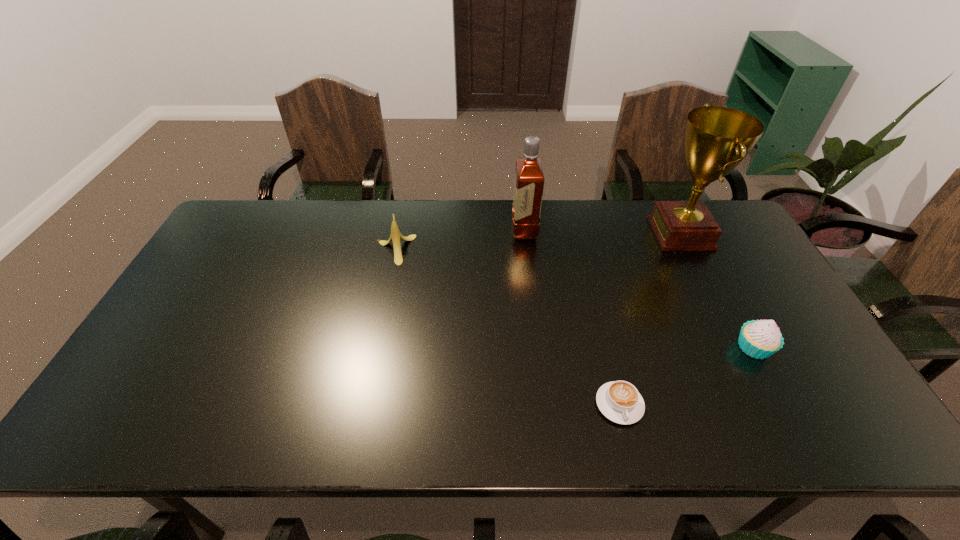
Locate an element on the screen. cupcake present at the right edge is located at coordinates (759, 339).

Where is `object at the far right corner`? Image resolution: width=960 pixels, height=540 pixels. object at the far right corner is located at coordinates (716, 139).

Where is `vacant space at the far edge of the desktop`? vacant space at the far edge of the desktop is located at coordinates (330, 200).

The image size is (960, 540). In the image, there is a desktop. In order to click on free space at the near edge in this screenshot , I will do `click(564, 429)`.

In the image, there is a desktop. Identify the location of vacant space at the left edge. (256, 250).

The image size is (960, 540). In the image, there is a desktop. Find the location of `free space at the far left corner`. free space at the far left corner is located at coordinates (244, 232).

In the image, there is a desktop. At what (x,y) coordinates should I click in order to perform the action: click on free region at the near left corner. Please return your answer as a coordinate pair (x, y). The image size is (960, 540). Looking at the image, I should click on (166, 426).

The width and height of the screenshot is (960, 540). I want to click on empty space between the leftmost object and the third object from right to left, so click(507, 327).

Where is `free space between the liquor and the award`? This screenshot has height=540, width=960. free space between the liquor and the award is located at coordinates (603, 231).

This screenshot has width=960, height=540. Find the location of `vacant space that's between the second tallest object and the banana`. vacant space that's between the second tallest object and the banana is located at coordinates (460, 240).